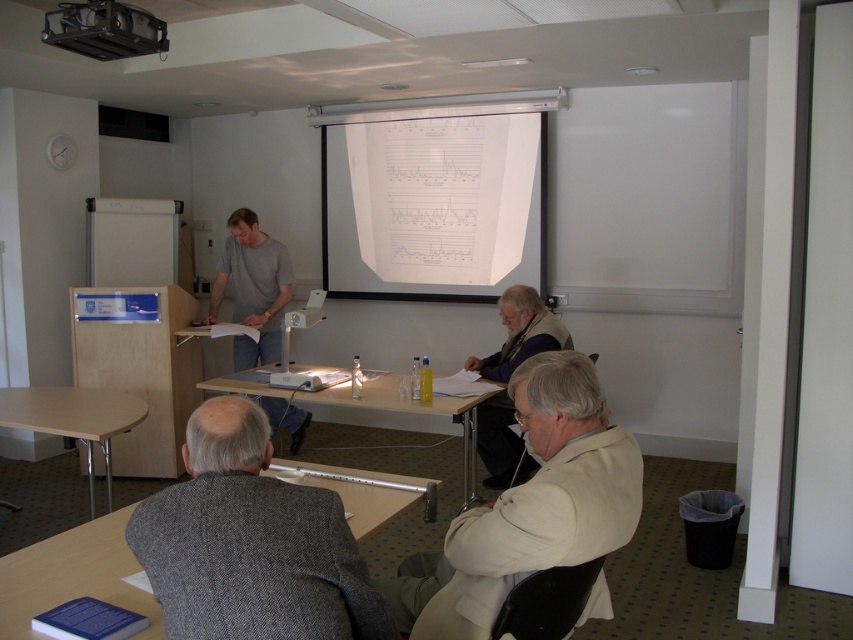
You are organizing a small event and need to place a decorative item on the wooden table at lower center. However, you also want to ensure that the beige fabric coat at lower right is still accessible. Given their sizes, can you place the item without blocking the coat?

The beige fabric coat at lower right is smaller than the wooden table at lower center. Since the coat is smaller, you can place the decorative item on the wooden table at lower center while leaving enough space to access the beige fabric coat at lower right.

You are standing at the entrance of the conference room and want to place a beige fabric coat at lower right exactly at coordinate point 0.792, 0.621. Can you confirm if there is enough space there?

The beige fabric coat at lower right is already positioned at the coordinate point (529, 506), so there is enough space for it there.

You are attending a presentation in the conference room and notice two attendees wearing a beige fabric coat at lower right and a gray cotton shirt at center. Which attendee is sitting closer to the front of the room?

The beige fabric coat at lower right is closer to the viewer than the gray cotton shirt at center, so the attendee wearing the beige fabric coat at lower right is sitting closer to the front of the room.